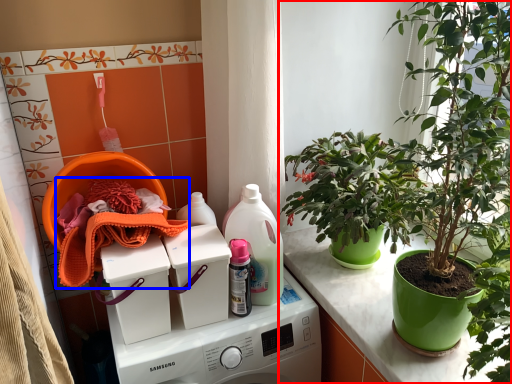
Question: Which point is closer to the camera, houseplant (highlighted by a red box) or material (highlighted by a blue box)?

Choices:
 (A) houseplant
 (B) material

Answer: (A)